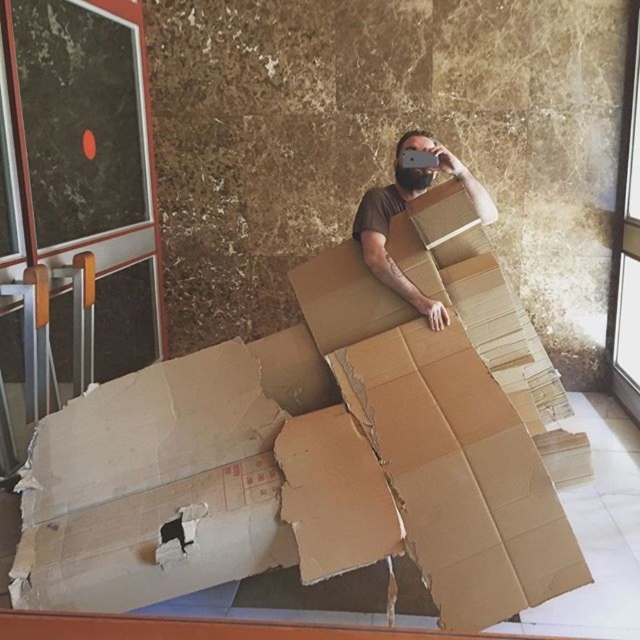
Question: Which of the following is the farthest from the observer?

Choices:
 (A) (472, 186)
 (B) (177, 385)

Answer: (B)

Question: Is brown corrugated cardboard at center behind brown cardboard at center?

Choices:
 (A) yes
 (B) no

Answer: (B)

Question: Can you confirm if brown corrugated cardboard at center is thinner than brown cardboard at center?

Choices:
 (A) yes
 (B) no

Answer: (B)

Question: Does brown corrugated cardboard at center have a smaller size compared to brown cardboard at center?

Choices:
 (A) no
 (B) yes

Answer: (A)